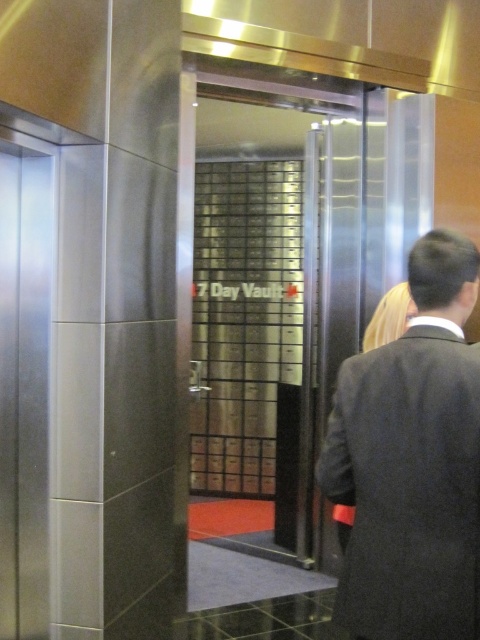
Question: Is clear glass door at center behind dark gray suit at right?

Choices:
 (A) no
 (B) yes

Answer: (B)

Question: Is clear glass door at center bigger than dark gray suit at right?

Choices:
 (A) yes
 (B) no

Answer: (A)

Question: Is clear glass door at center thinner than dark gray suit at right?

Choices:
 (A) yes
 (B) no

Answer: (B)